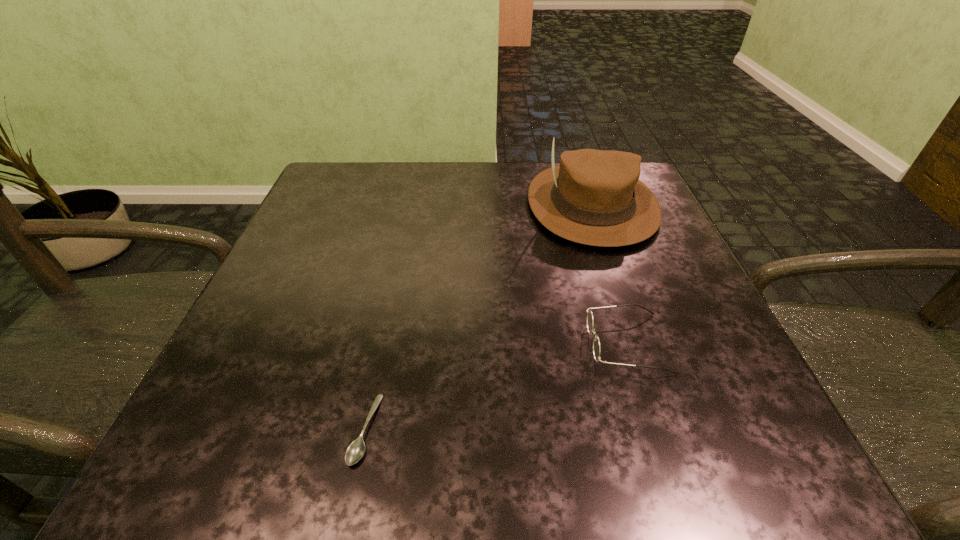
In the image, there is a desktop. Where is `vacant space at the far left corner`? Image resolution: width=960 pixels, height=540 pixels. vacant space at the far left corner is located at coordinates (349, 185).

In order to click on free space at the near right corner in this screenshot , I will do `click(726, 449)`.

I want to click on vacant area that lies between the shortest object and the spectacles, so click(x=496, y=386).

Find the location of a particular element. vacant space that is in between the spectacles and the fedora is located at coordinates (610, 274).

Locate an element on the screen. The width and height of the screenshot is (960, 540). free space that is in between the second nearest object and the shortest object is located at coordinates (496, 386).

The width and height of the screenshot is (960, 540). In order to click on blank region between the nearest object and the second farthest object in this screenshot , I will do `click(496, 386)`.

Image resolution: width=960 pixels, height=540 pixels. I want to click on unoccupied area between the farthest object and the spectacles, so click(x=610, y=274).

Find the location of a particular element. The width and height of the screenshot is (960, 540). vacant area between the soupspoon and the spectacles is located at coordinates (496, 386).

Find the location of a particular element. The image size is (960, 540). empty space between the soupspoon and the farthest object is located at coordinates (478, 317).

Where is `free space between the shortest object and the tallest object`? The height and width of the screenshot is (540, 960). free space between the shortest object and the tallest object is located at coordinates (478, 317).